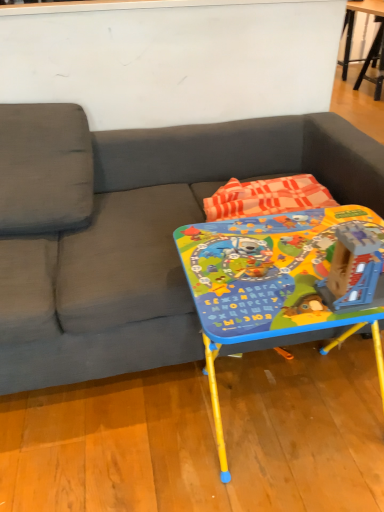
The width and height of the screenshot is (384, 512). I want to click on blank space situated above matte plastic table at center, the first table in the left-to-right sequence (from a real-world perspective), so click(x=271, y=256).